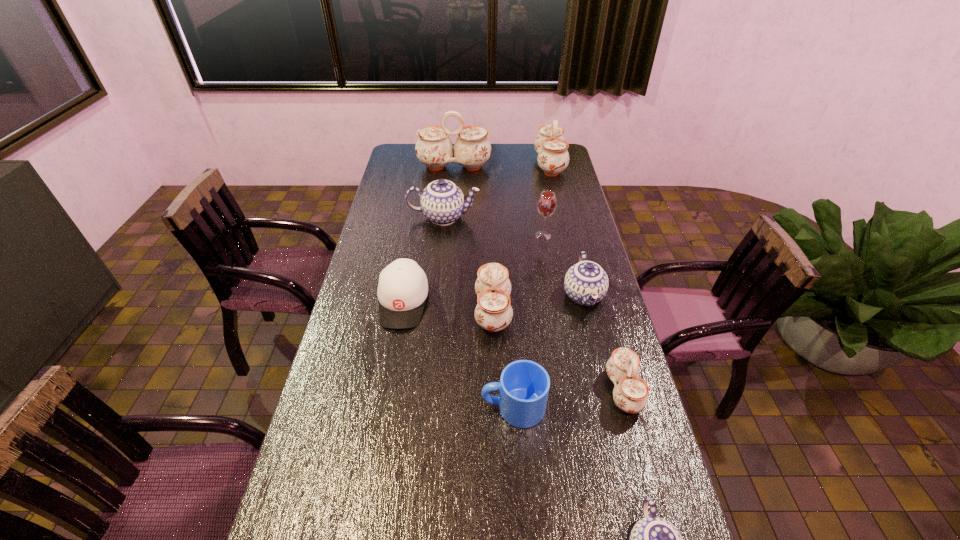
Locate an element on the screen. The width and height of the screenshot is (960, 540). the smallest white chinaware is located at coordinates (631, 394).

The height and width of the screenshot is (540, 960). Identify the location of mug. (524, 385).

Locate an element on the screen. white baseball cap is located at coordinates (403, 287).

This screenshot has height=540, width=960. I want to click on vacant point located 0.240m by the handle of the tallest object, so click(451, 204).

This screenshot has width=960, height=540. In order to click on free space located 0.280m by the handle of the sixth shortest chinaware in this screenshot , I will do `click(477, 165)`.

Locate an element on the screen. vacant space located by the handle of the sixth shortest chinaware is located at coordinates (463, 165).

The width and height of the screenshot is (960, 540). I want to click on free space located 0.090m by the handle of the sixth shortest chinaware, so click(x=516, y=165).

The width and height of the screenshot is (960, 540). I want to click on free space located on the front of the fourth farthest object, so click(x=557, y=314).

The image size is (960, 540). I want to click on vacant space positioned 0.070m by the handle of the third biggest white chinaware, so click(453, 312).

Locate an element on the screen. Image resolution: width=960 pixels, height=540 pixels. vacant space located 0.320m by the handle of the third biggest white chinaware is located at coordinates (377, 312).